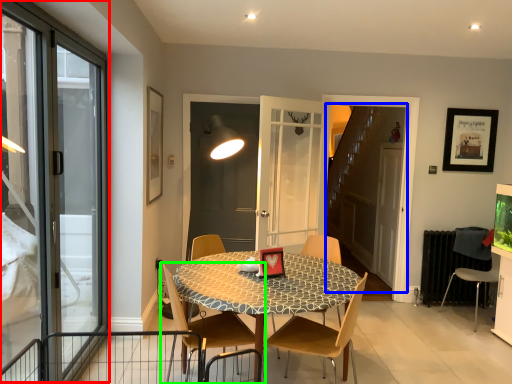
Question: Which is nearer to the window (highlighted by a red box)? elevator (highlighted by a blue box) or chair (highlighted by a green box).

Choices:
 (A) elevator
 (B) chair

Answer: (B)